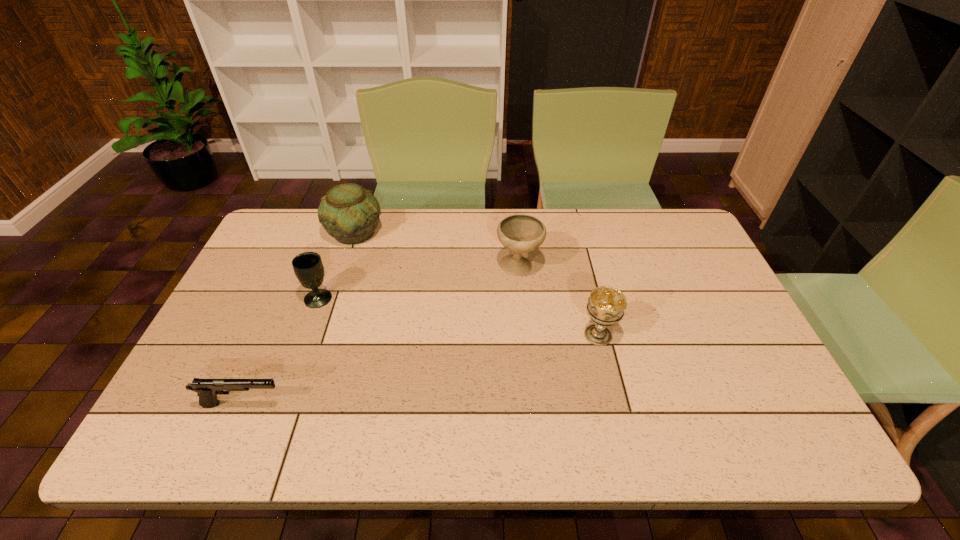
The height and width of the screenshot is (540, 960). Find the location of `unoccupied area between the pottery and the fourth object from left to right`. unoccupied area between the pottery and the fourth object from left to right is located at coordinates (437, 249).

Locate which object ranks fourth in proximity to the third farthest object. Please provide its 2D coordinates. Your answer should be formatted as a tuple, i.e. [(x, y)], where the tuple contains the x and y coordinates of a point satisfying the conditions above.

[(606, 305)]

Find the location of `the fourth closest object to the third farthest object`. the fourth closest object to the third farthest object is located at coordinates (606, 305).

This screenshot has width=960, height=540. What are the coordinates of `chalice that is the third closest to the farthest object` in the screenshot? It's located at (606, 305).

I want to click on the second closest chalice to the nearest object, so click(519, 233).

At what (x,y) coordinates should I click in order to perform the action: click on free region that satisfies the following two spatial constraints: 1. on the front side of the farthest object; 2. on the left side of the second nearest object. Please return your answer as a coordinate pair (x, y). The image size is (960, 540). Looking at the image, I should click on (321, 335).

This screenshot has width=960, height=540. Find the location of `vacant region that satisfies the following two spatial constraints: 1. on the front side of the farthest object; 2. on the right side of the fourth object from left to right`. vacant region that satisfies the following two spatial constraints: 1. on the front side of the farthest object; 2. on the right side of the fourth object from left to right is located at coordinates (344, 267).